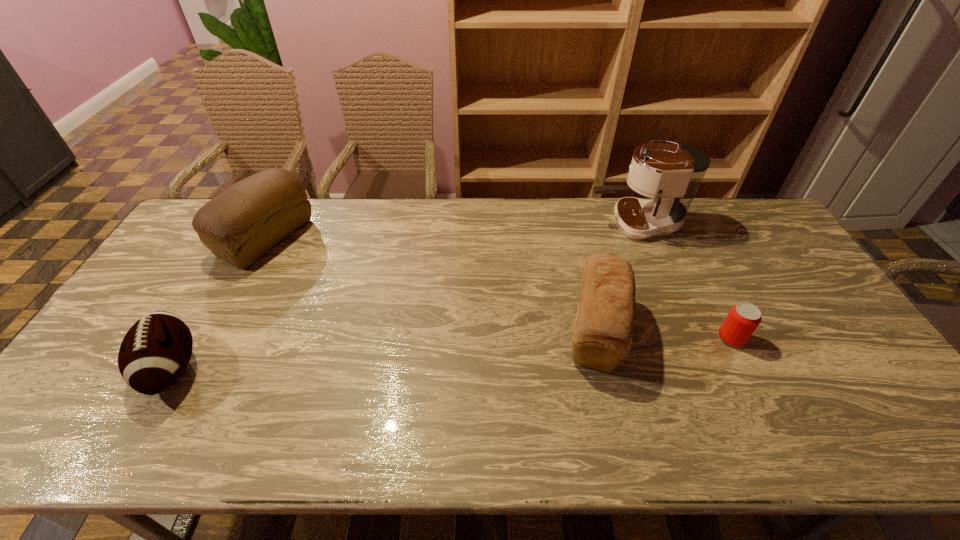
Where is `free region at the far right corner of the desktop`? The width and height of the screenshot is (960, 540). free region at the far right corner of the desktop is located at coordinates (755, 210).

At what (x,y) coordinates should I click in order to perform the action: click on free space between the tallest object and the beer can. Please return your answer as a coordinate pair (x, y). Image resolution: width=960 pixels, height=540 pixels. Looking at the image, I should click on (684, 281).

This screenshot has width=960, height=540. Identify the location of free space between the right bread and the left bread. (431, 284).

You are a GUI agent. You are given a task and a screenshot of the screen. Output one action in this format:
    pyautogui.click(x=<x>, y=<y>)
    Task: Click on the vacant space that's between the farther bread and the coffee maker
    
    Given the screenshot: What is the action you would take?
    pyautogui.click(x=450, y=231)

The width and height of the screenshot is (960, 540). Find the location of `vacant area between the farther bread and the right bread`. vacant area between the farther bread and the right bread is located at coordinates (431, 284).

Where is `vacant space that is in between the right bread and the left bread`? The width and height of the screenshot is (960, 540). vacant space that is in between the right bread and the left bread is located at coordinates (431, 284).

The height and width of the screenshot is (540, 960). Identify the location of free space between the left bread and the right bread. (431, 284).

Image resolution: width=960 pixels, height=540 pixels. What are the coordinates of `vacant point located between the right bread and the shortest object` in the screenshot? It's located at (x=664, y=334).

The width and height of the screenshot is (960, 540). I want to click on free spot between the beer can and the second shortest object, so click(x=452, y=353).

Select which object appears as the closest to the beer can. Please provide its 2D coordinates. Your answer should be formatted as a tuple, i.e. [(x, y)], where the tuple contains the x and y coordinates of a point satisfying the conditions above.

[(602, 337)]